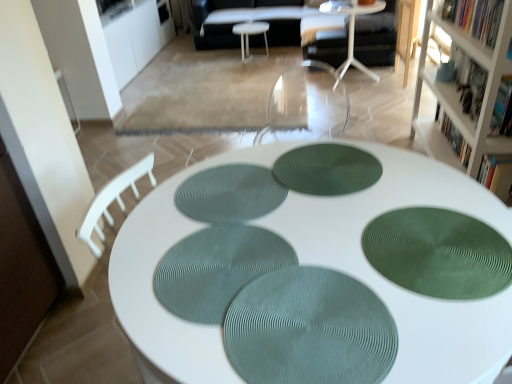
This screenshot has width=512, height=384. In order to click on free space on the front side of green textured placemat at center, marked as the 3th mat in a left-to-right arrangement in this screenshot , I will do `click(349, 231)`.